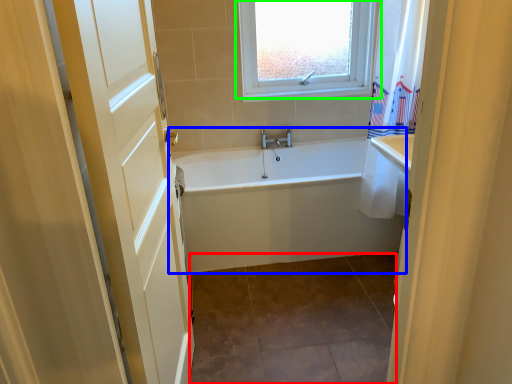
Question: Which object is positioned farthest from tile (highlighted by a red box)? Select from bathtub (highlighted by a blue box) and window (highlighted by a green box).

Choices:
 (A) bathtub
 (B) window

Answer: (B)